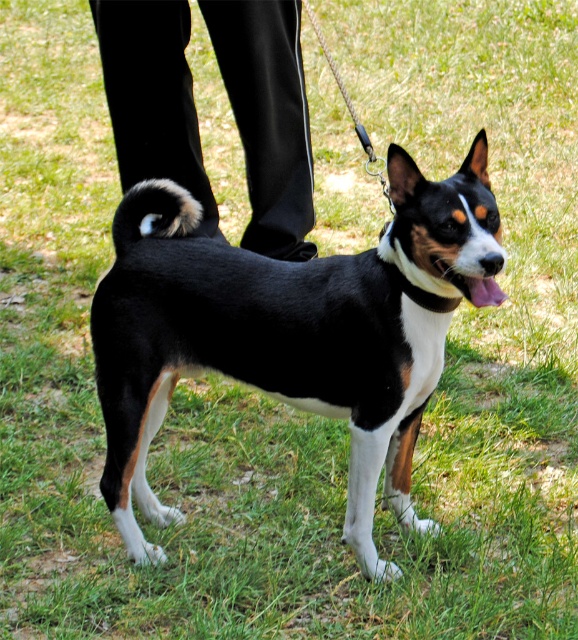
Between black smooth pants at lower center and white fabric neckband at center, which one has more height?

With more height is black smooth pants at lower center.

Find the location of a particular element. This screenshot has height=640, width=578. black smooth pants at lower center is located at coordinates (268, 116).

Between point (146, 32) and point (403, 284), which one is positioned in front?

Point (403, 284) is in front.

I want to click on black smooth pants at lower center, so click(x=268, y=116).

Does black and white fur dog at center come in front of fuzzy black tail at center?

Yes, it is in front of fuzzy black tail at center.

Does black and white fur dog at center have a greater width compared to fuzzy black tail at center?

Indeed, black and white fur dog at center has a greater width compared to fuzzy black tail at center.

Who is more distant from viewer, (397, 470) or (164, 218)?

The point (397, 470) is more distant.

The width and height of the screenshot is (578, 640). I want to click on black and white fur dog at center, so click(x=295, y=340).

Is point (186, 193) less distant than point (420, 289)?

No, it is behind (420, 289).

Can you confirm if fuzzy black tail at center is wider than white fabric neckband at center?

Yes.

Is point (146, 195) in front of point (416, 296)?

No, (146, 195) is further to viewer.

Where is `fuzzy black tail at center`? The height and width of the screenshot is (640, 578). fuzzy black tail at center is located at coordinates (153, 212).